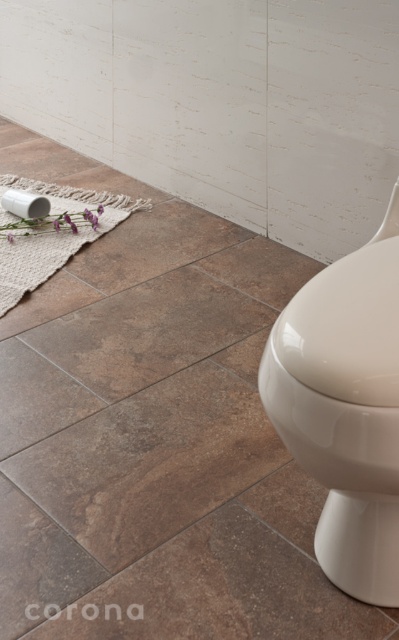
Is brown tile at center positioned in front of brown textured tile at lower left?

That is False.

Is point (108, 371) positioned in front of point (67, 536)?

No, it is behind (67, 536).

What do you see at coordinates (148, 332) in the screenshot? I see `brown tile at center` at bounding box center [148, 332].

The width and height of the screenshot is (399, 640). Find the location of `brown tile at center`. brown tile at center is located at coordinates (148, 332).

Does glossy ceramic toilet bowl at lower right have a greater width compared to brown tile at lower left?

No.

Is glossy ceramic toilet bowl at lower right bigger than brown tile at lower left?

Correct, glossy ceramic toilet bowl at lower right is larger in size than brown tile at lower left.

This screenshot has width=399, height=640. I want to click on glossy ceramic toilet bowl at lower right, so click(345, 412).

Identify the location of glossy ceramic toilet bowl at lower right. click(345, 412).

Between point (116, 384) and point (45, 205), which one is positioned in front?

Point (116, 384)

Which of these two, brown tile at center or white matte toilet paper at lower left, stands shorter?

white matte toilet paper at lower left is shorter.

Which is in front, point (167, 348) or point (17, 200)?

Point (167, 348) is more forward.

Find the location of a particular element. The image size is (399, 640). brown tile at center is located at coordinates (148, 332).